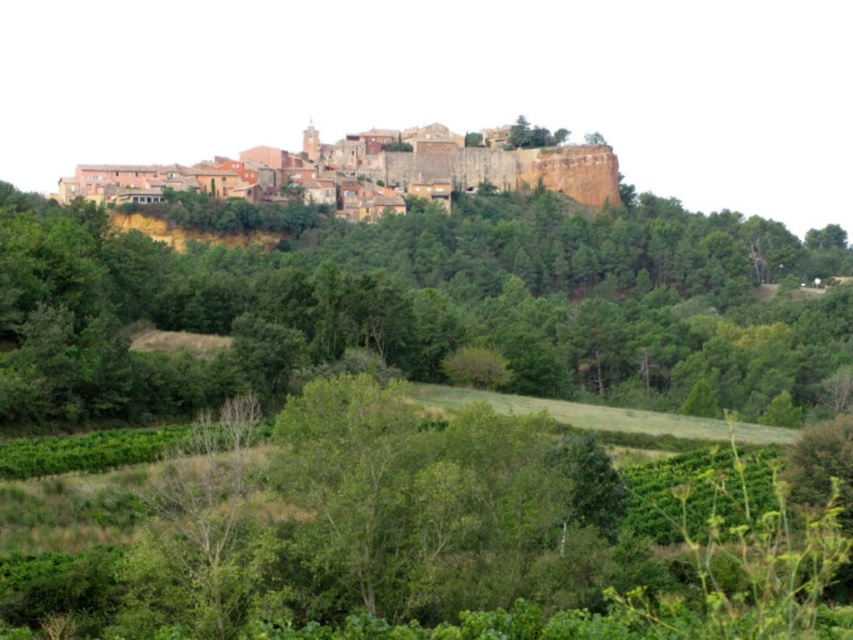
Between green leafy tree at upper center and terracotta stone town at upper center, which one has more height?

green leafy tree at upper center is taller.

Which is below, green leafy tree at upper center or terracotta stone town at upper center?

green leafy tree at upper center

At what (x,y) coordinates should I click in order to perform the action: click on green leafy tree at upper center. Please return your answer as a coordinate pair (x, y). The image size is (853, 640). Looking at the image, I should click on (460, 291).